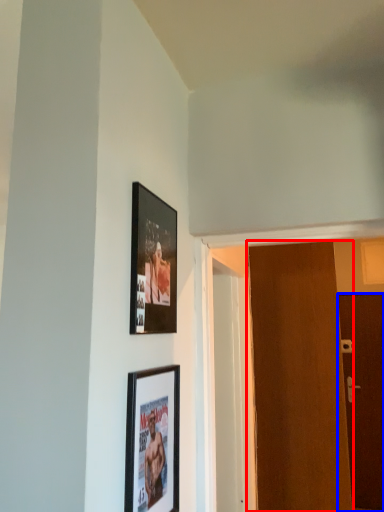
Question: Which object is closer to the camera taking this photo, door (highlighted by a red box) or door (highlighted by a blue box)?

Choices:
 (A) door
 (B) door

Answer: (A)